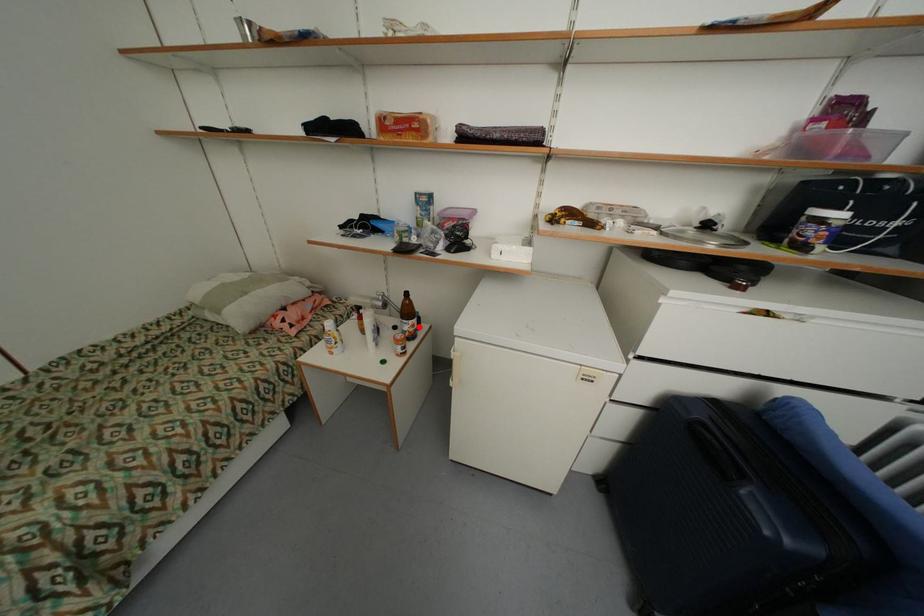
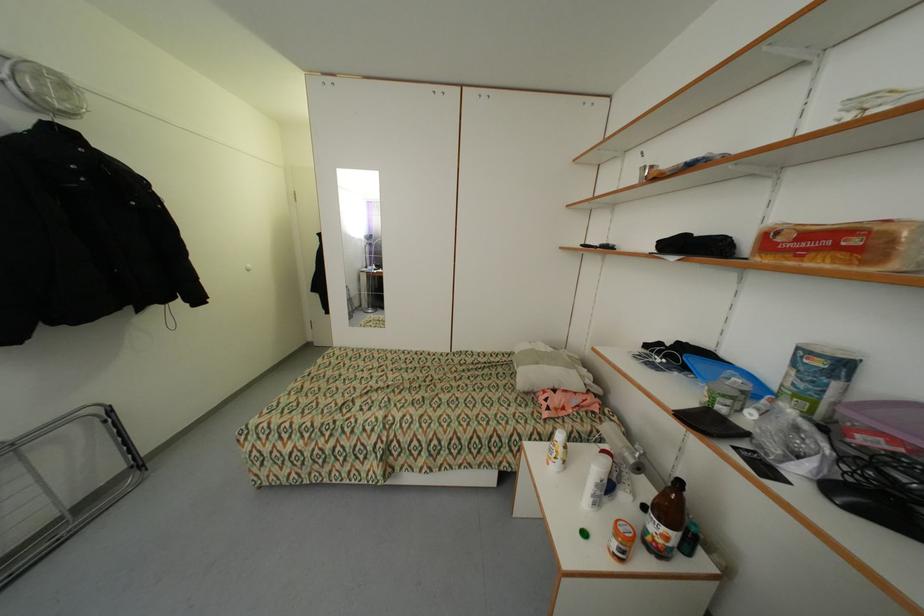
Question: I am providing you with two images of the same scene from different viewpoints. In image1, a red point is highlighted. Considering the same 3D point in image2, which of the following is correct?

Choices:
 (A) It is closer
 (B) It is farther

Answer: (B)